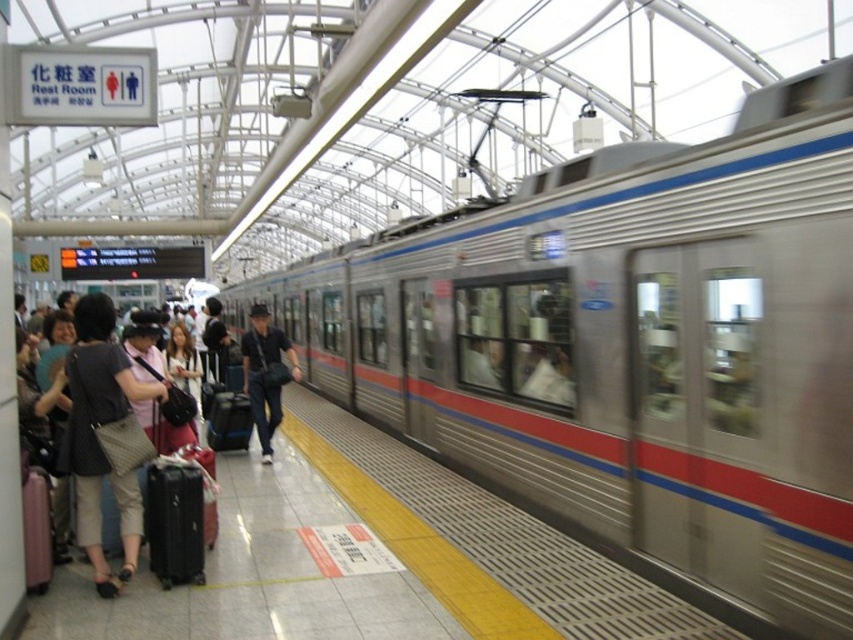
Question: Can you confirm if black hard suitcase at center is bigger than matte pink suitcase at lower left?

Choices:
 (A) yes
 (B) no

Answer: (A)

Question: Considering the relative positions of silver metallic train at center and matte black bag at center in the image provided, where is silver metallic train at center located with respect to matte black bag at center?

Choices:
 (A) right
 (B) left

Answer: (A)

Question: Estimate the real-world distances between objects in this image. Which object is closer to the silver metallic train at center?

Choices:
 (A) black hard suitcase at center
 (B) matte pink suitcase at lower left
 (C) matte black bag at center

Answer: (C)

Question: Can you confirm if silver metallic train at center is bigger than matte pink suitcase at lower left?

Choices:
 (A) yes
 (B) no

Answer: (A)

Question: Which object appears closest to the camera in this image?

Choices:
 (A) black hard suitcase at center
 (B) silver metallic train at center

Answer: (B)

Question: Which point is closer to the camera taking this photo?

Choices:
 (A) (146, 468)
 (B) (250, 385)

Answer: (A)